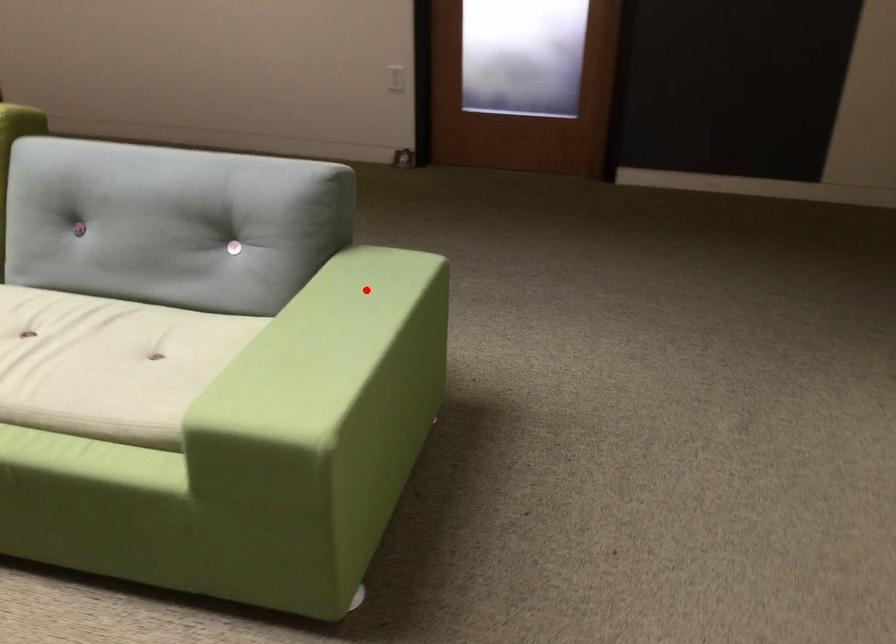
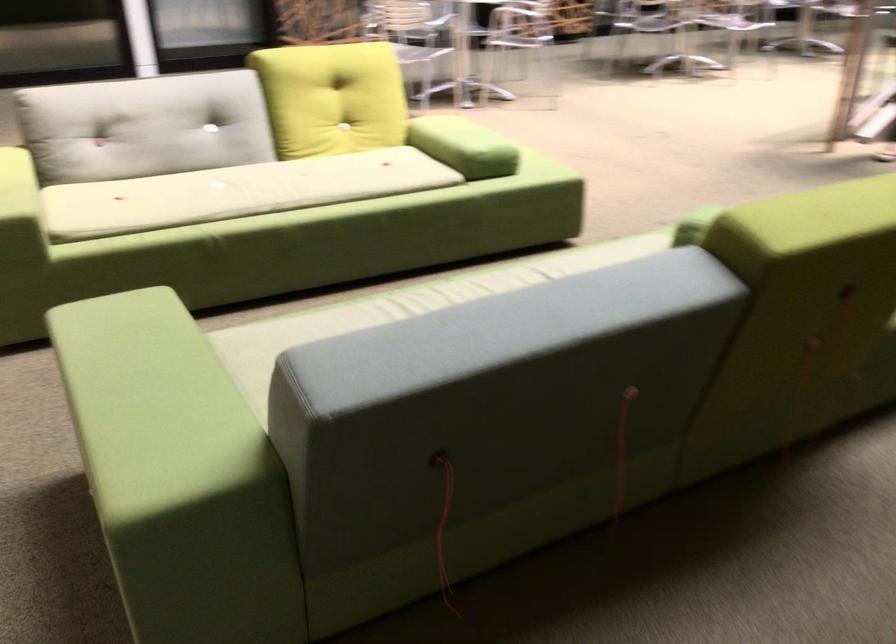
Question: I am providing you with two images of the same scene from different viewpoints. Image1 has a red point marked. In image2, the corresponding 3D location appears at what relative position? Reply with the corresponding letter.

Choices:
 (A) Closer
 (B) Farther

Answer: (A)